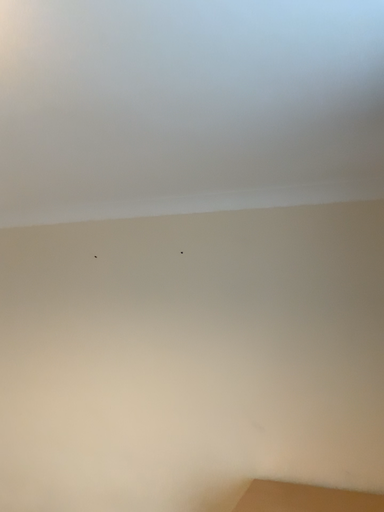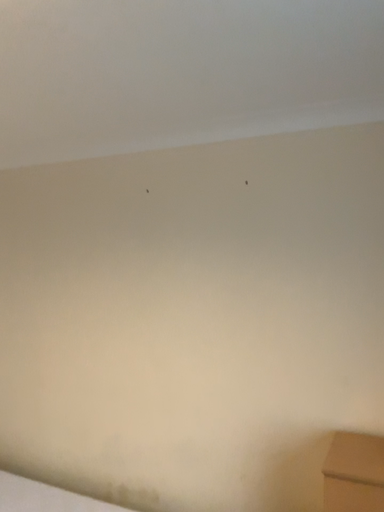
Question: How did the camera likely rotate when shooting the video?

Choices:
 (A) rotated upward
 (B) rotated downward

Answer: (B)